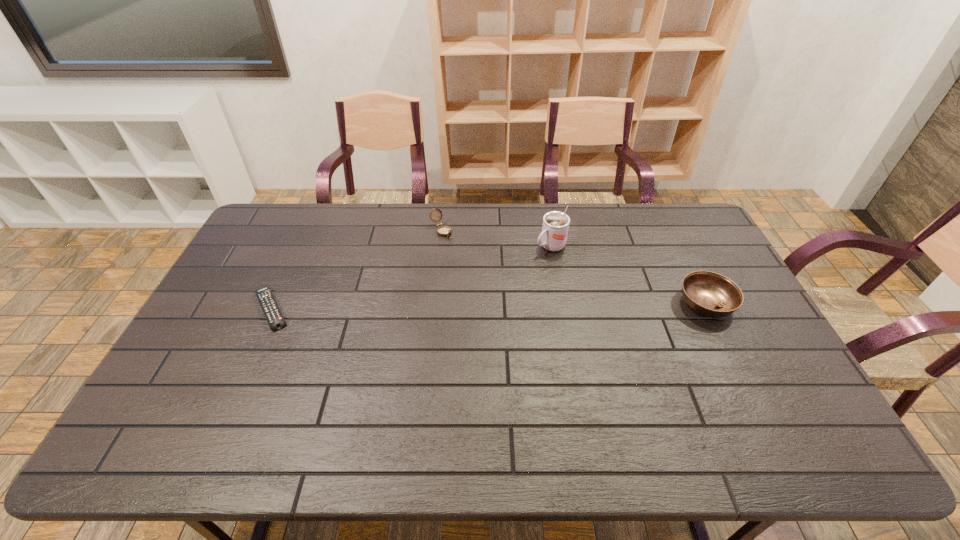
At what (x,y) coordinates should I click in order to perform the action: click on free space on the desktop that is between the shortest object and the rightmost object and is positioned on the face of the second object from left to right. Please return your answer as a coordinate pair (x, y). Image resolution: width=960 pixels, height=540 pixels. Looking at the image, I should click on (513, 306).

Image resolution: width=960 pixels, height=540 pixels. In order to click on vacant space on the desktop that is between the remote control and the soup bowl and is positioned on the side with the handle of the tallest object in this screenshot , I will do [456, 307].